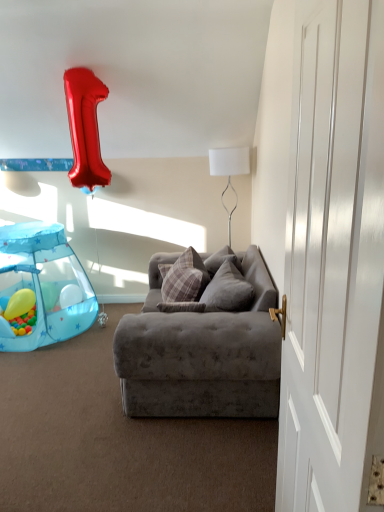
Question: Relative to plaid fabric pillow at center, which appears as the first pillow when viewed from the left, is white smooth door at right in front or behind?

Choices:
 (A) behind
 (B) front

Answer: (B)

Question: From a real-world perspective, relative to plaid fabric pillow at center, which is counted as the 2th pillow, starting from the right, is white smooth door at right vertically above or below?

Choices:
 (A) above
 (B) below

Answer: (A)

Question: Estimate the real-world distances between objects in this image. Which object is farther from the velvet gray couch at center?

Choices:
 (A) white smooth door at right
 (B) yellow rubber balloon at lower left
 (C) blue fabric playpen at lower left
 (D) plaid fabric pillow at center, which is counted as the 2th pillow, starting from the right
 (E) plush gray pillow at center, arranged as the 2th pillow when viewed from the left

Answer: (B)

Question: Which object is the closest to the plush gray pillow at center, arranged as the 2th pillow when viewed from the left?

Choices:
 (A) yellow rubber balloon at lower left
 (B) velvet gray couch at center
 (C) blue fabric playpen at lower left
 (D) white smooth door at right
 (E) white fabric lampshade at upper center

Answer: (B)